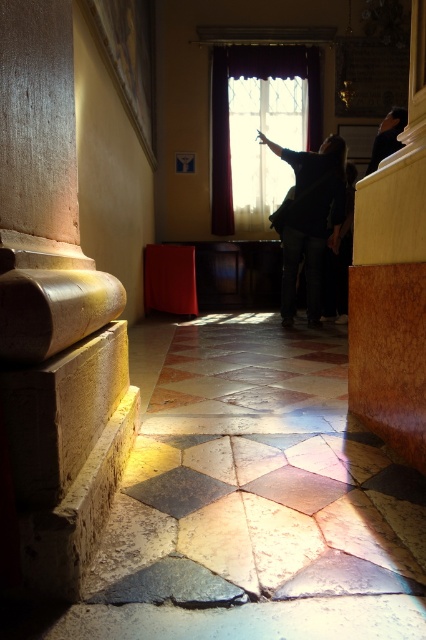
Question: Is polished stone column at left bigger than dark fabric at center?

Choices:
 (A) no
 (B) yes

Answer: (A)

Question: Which point is closer to the camera?

Choices:
 (A) (58, 282)
 (B) (382, 131)
 (C) (327, 220)

Answer: (A)

Question: Observing the image, what is the correct spatial positioning of polished stone column at left in reference to dark blue fabric at upper right?

Choices:
 (A) left
 (B) right

Answer: (A)

Question: Which is farther from the polished stone column at left?

Choices:
 (A) dark fabric at center
 (B) dark blue fabric at upper right

Answer: (B)

Question: Can you confirm if polished stone column at left is positioned below dark fabric at center?

Choices:
 (A) yes
 (B) no

Answer: (A)

Question: Among these points, which one is farthest from the camera?

Choices:
 (A) (308, 184)
 (B) (377, 148)
 (C) (86, 531)

Answer: (B)